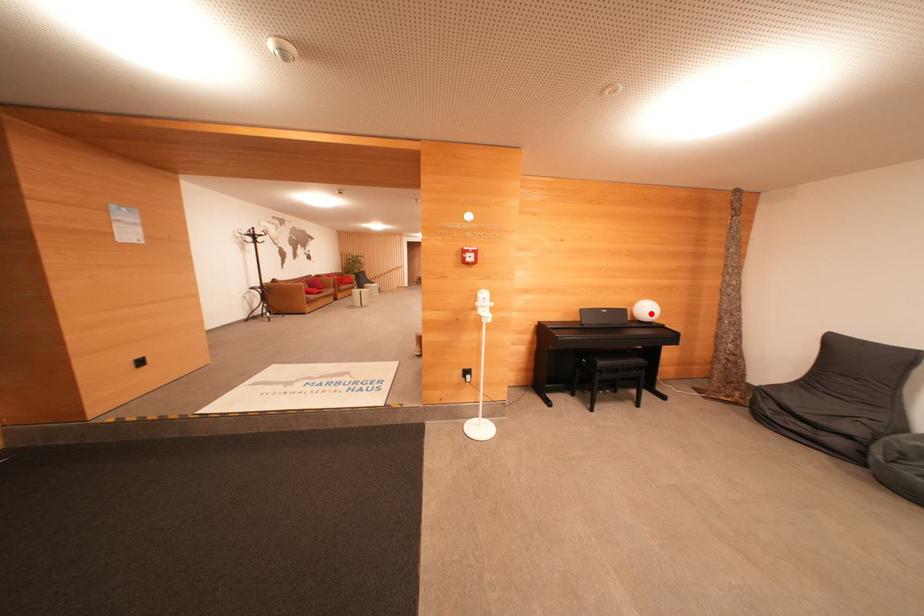
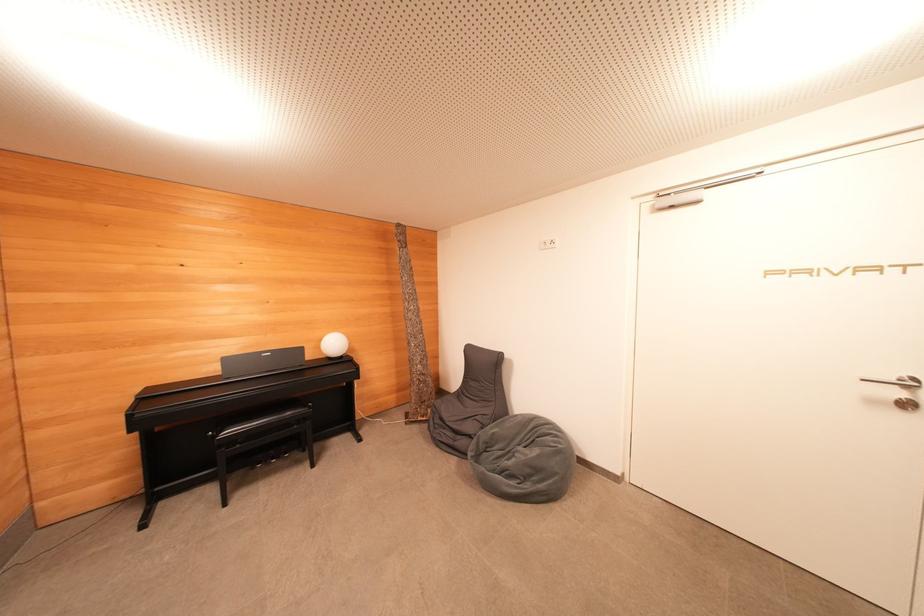
The point at the highlighted location is marked in the first image. Where is the corresponding point in the second image?

(337, 347)